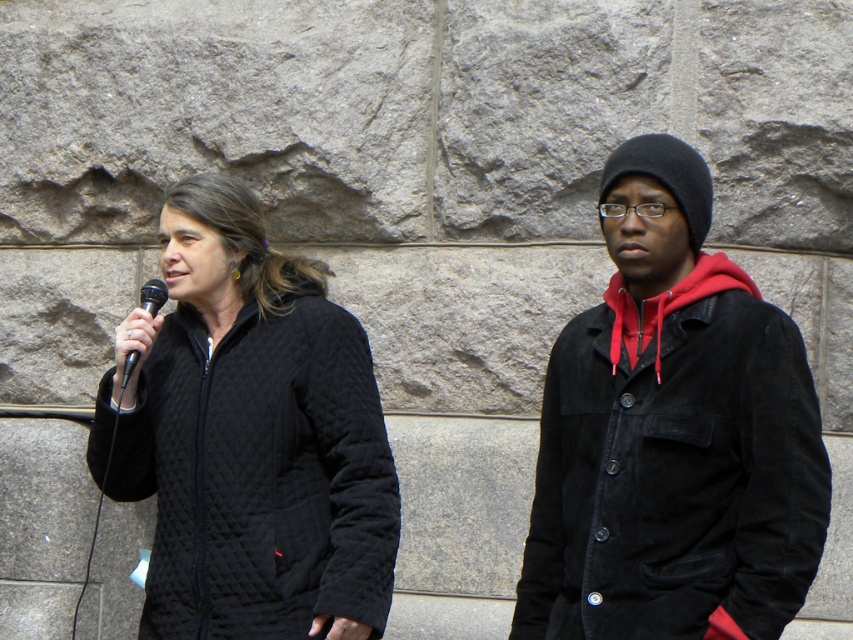
You are a photographer trying to capture both the suede jacket at right and the quilted black jacket at center in a single shot. Since the camera can only focus on one subject at a time, which jacket should you focus on to ensure the other remains in the background?

The suede jacket at right is located above the quilted black jacket at center, so focusing on the suede jacket at right will keep the quilted black jacket at center in the background.

You are a photographer trying to capture a closeup of the suede jacket at right. Given the coordinates provided, can you estimate the jacket is located in the upper half or lower half of the image?

The suede jacket at right is located at coordinates point (672, 433). Since the y coordinate is 0.789, which is above 0.5, the jacket is in the upper half of the image.

You are standing in front of the stone wall and want to place a small sticker on the point closer to you. Which point should you choose between the point at coordinates point (572, 326) and point (250, 342)?

You should choose point (572, 326) because it is closer to you than point (250, 342).